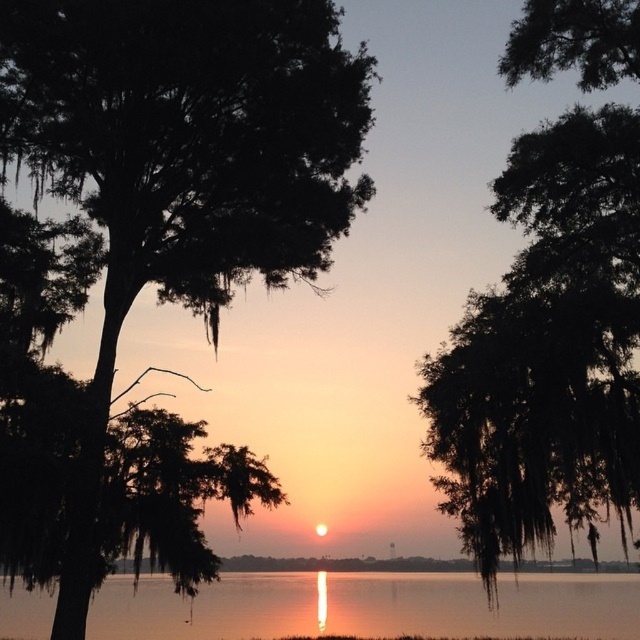
Question: Which object is positioned farthest from the smooth water at center?

Choices:
 (A) silhouette tree at left
 (B) green mossy tree at upper right

Answer: (A)

Question: Which point is closer to the camera?

Choices:
 (A) (262, 595)
 (B) (564, 163)
 (C) (211, 211)

Answer: (B)

Question: Is the position of silhouette tree at left less distant than that of green mossy tree at upper right?

Choices:
 (A) yes
 (B) no

Answer: (B)

Question: Is silhouette tree at left wider than smooth water at center?

Choices:
 (A) yes
 (B) no

Answer: (B)

Question: Does silhouette tree at left have a greater width compared to green mossy tree at upper right?

Choices:
 (A) no
 (B) yes

Answer: (B)

Question: Which of the following is the closest to the observer?

Choices:
 (A) (481, 314)
 (B) (60, 132)
 (C) (166, 593)

Answer: (A)